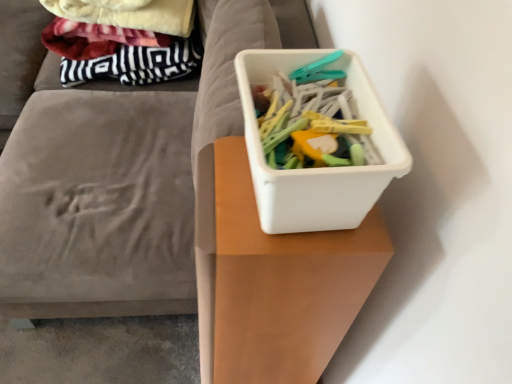
Question: In the image, is white plastic container at upper right on the left side or the right side of white plastic container at center?

Choices:
 (A) right
 (B) left

Answer: (B)

Question: Looking at their shapes, would you say white plastic container at upper right is wider or thinner than white plastic container at center?

Choices:
 (A) thin
 (B) wide

Answer: (B)

Question: Estimate the real-world distances between objects in this image. Which object is closer to the white plastic container at center?

Choices:
 (A) white plastic container at center
 (B) white plastic container at upper right

Answer: (B)

Question: Estimate the real-world distances between objects in this image. Which object is closer to the white plastic container at upper right?

Choices:
 (A) white plastic container at center
 (B) white plastic container at center

Answer: (A)